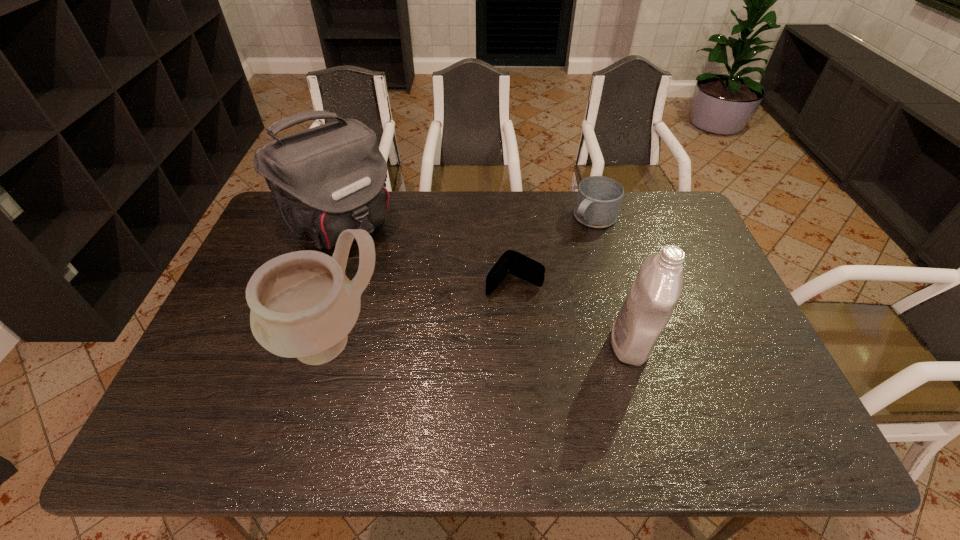
Where is `free space on the desktop that is between the pottery and the detergent and is positioned on the side of the second shortest object with the handle`? free space on the desktop that is between the pottery and the detergent and is positioned on the side of the second shortest object with the handle is located at coordinates (468, 342).

The width and height of the screenshot is (960, 540). In order to click on free spot on the desktop that is between the pottery and the detergent and is positioned on the outer surface of the wallet in this screenshot , I will do `click(468, 342)`.

Locate an element on the screen. vacant space on the desktop that is between the pottery and the detergent and is positioned on the open flap of the tallest object is located at coordinates (462, 342).